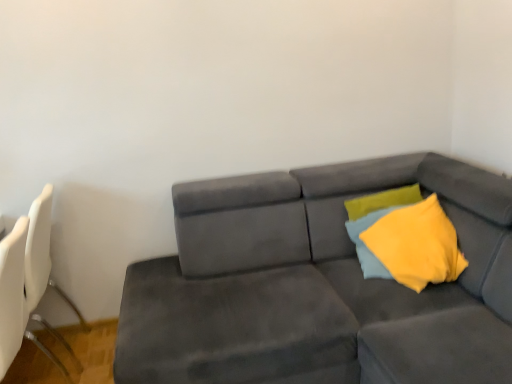
Question: Is suede gray couch at center to the right of yellow fabric pillow at upper right from the viewer's perspective?

Choices:
 (A) yes
 (B) no

Answer: (B)

Question: Does suede gray couch at center have a lesser height compared to yellow fabric pillow at upper right?

Choices:
 (A) yes
 (B) no

Answer: (B)

Question: Does suede gray couch at center have a smaller size compared to yellow fabric pillow at upper right?

Choices:
 (A) no
 (B) yes

Answer: (A)

Question: Is suede gray couch at center placed right next to yellow fabric pillow at upper right?

Choices:
 (A) yes
 (B) no

Answer: (B)

Question: Is suede gray couch at center in front of yellow fabric pillow at upper right?

Choices:
 (A) no
 (B) yes

Answer: (B)

Question: From the image's perspective, is suede gray couch at center over yellow fabric pillow at upper right?

Choices:
 (A) yes
 (B) no

Answer: (B)

Question: From the image's perspective, would you say yellow fabric pillow at upper right is shown under white plastic swivel chair at left?

Choices:
 (A) no
 (B) yes

Answer: (A)

Question: Could white plastic swivel chair at left be considered to be inside yellow fabric pillow at upper right?

Choices:
 (A) no
 (B) yes

Answer: (A)

Question: Can you confirm if yellow fabric pillow at upper right is bigger than white plastic swivel chair at left?

Choices:
 (A) yes
 (B) no

Answer: (B)

Question: Is yellow fabric pillow at upper right positioned beyond the bounds of white plastic swivel chair at left?

Choices:
 (A) yes
 (B) no

Answer: (A)

Question: Is yellow fabric pillow at upper right to the left of white plastic swivel chair at left from the viewer's perspective?

Choices:
 (A) no
 (B) yes

Answer: (A)

Question: Is yellow fabric pillow at upper right closer to camera compared to white plastic swivel chair at left?

Choices:
 (A) yes
 (B) no

Answer: (B)

Question: Is suede gray couch at center outside of soft yellow fabric pillow at right?

Choices:
 (A) yes
 (B) no

Answer: (A)